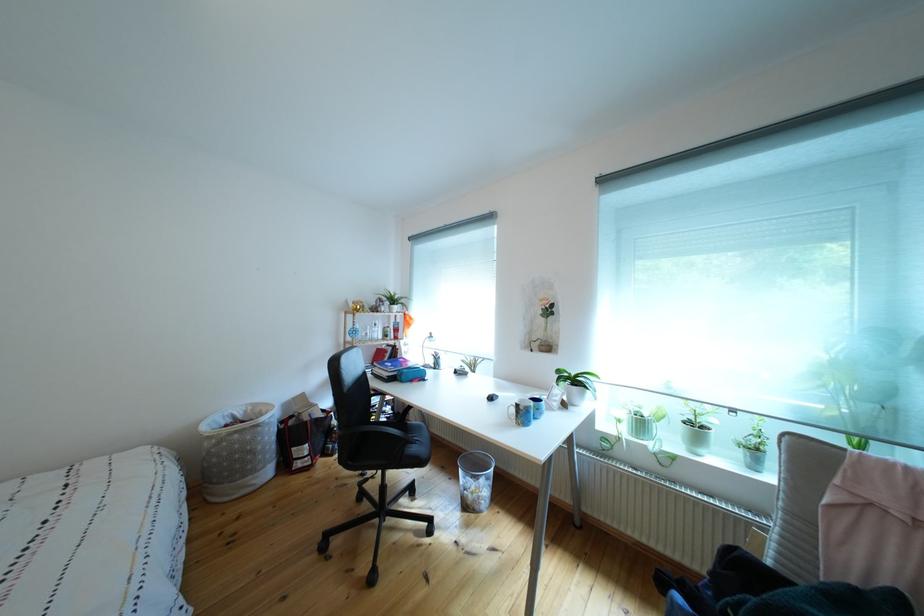
Find where to lift the green plant pot. Please return your answer as a coordinate pair (x, y).

(576, 384)